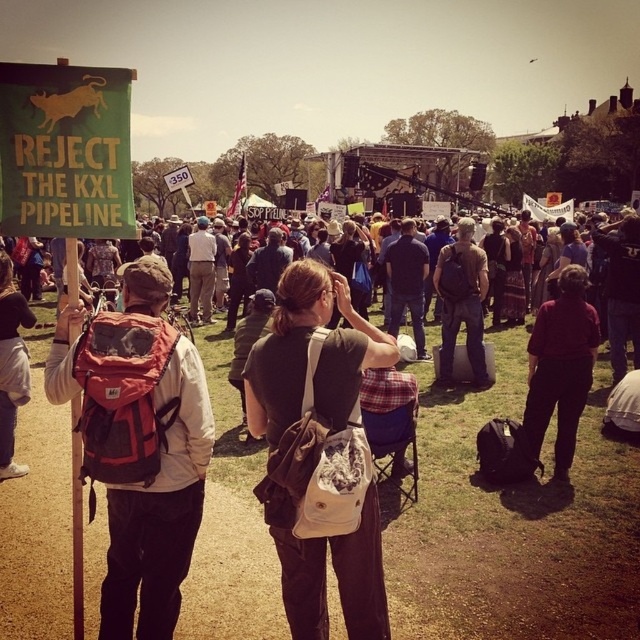
Question: Is brown canvas backpack at center smaller than red backpack at left?

Choices:
 (A) no
 (B) yes

Answer: (B)

Question: Which of the following is the closest to the observer?

Choices:
 (A) (556, 324)
 (B) (467, 346)

Answer: (A)

Question: Among these points, which one is farthest from the camera?

Choices:
 (A) (268, 490)
 (B) (141, 634)
 (C) (563, 432)

Answer: (C)

Question: Considering the relative positions of brown canvas backpack at center and dark red shirt at center in the image provided, where is brown canvas backpack at center located with respect to dark red shirt at center?

Choices:
 (A) right
 (B) left

Answer: (B)

Question: Which object appears farthest from the camera in this image?

Choices:
 (A) red backpack at left
 (B) dark red shirt at center
 (C) brown canvas backpack at center
 (D) brown backpack at center

Answer: (D)

Question: Does brown canvas backpack at center appear on the left side of dark red shirt at center?

Choices:
 (A) no
 (B) yes

Answer: (B)